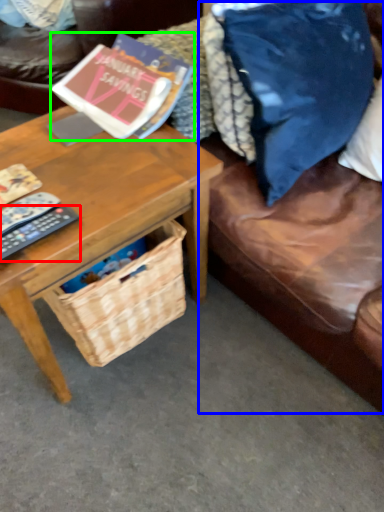
Question: Which is farther away from remote control (highlighted by a red box)? couch (highlighted by a blue box) or book (highlighted by a green box)?

Choices:
 (A) couch
 (B) book

Answer: (A)